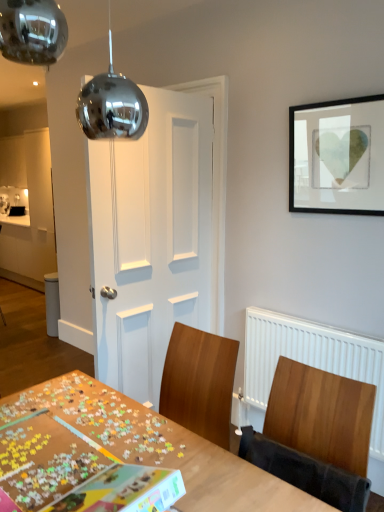
I want to click on vacant space situated above wooden puzzle board at center (from a real-world perspective), so click(x=104, y=438).